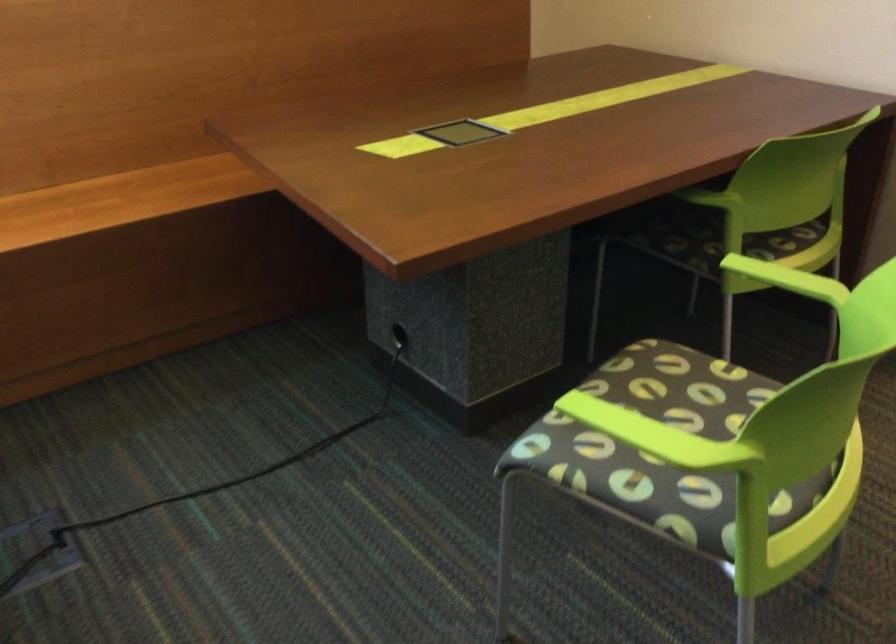
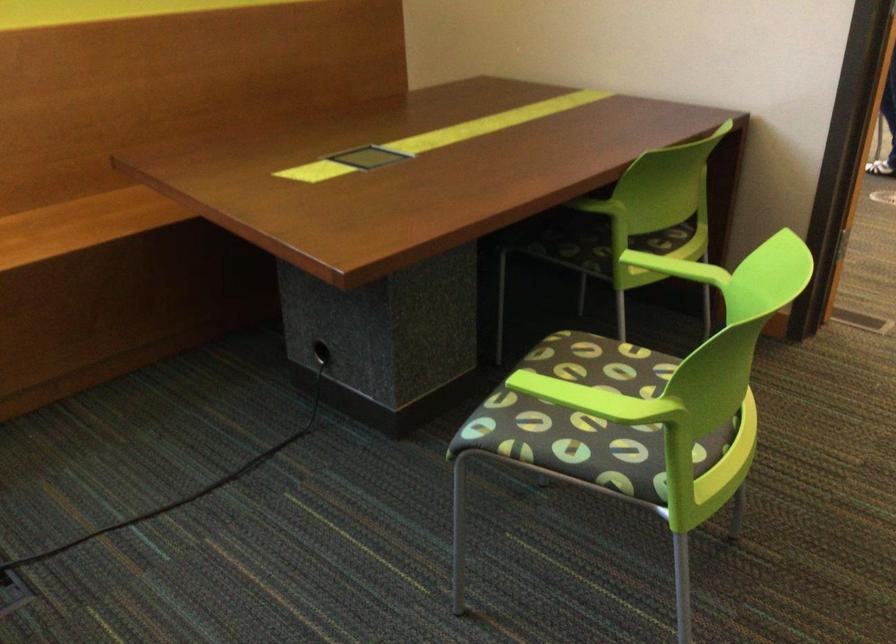
Locate, in the second image, the point that corresponds to (x=659, y=431) in the first image.

(599, 399)